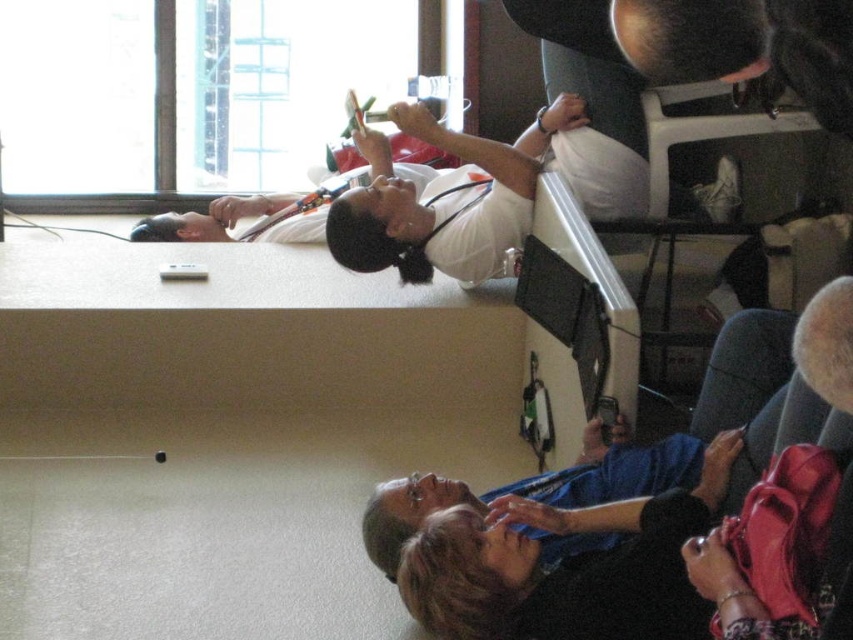
You are a student in a classroom. You see a white matte stethoscope at upper center and a blue fabric shirt at lower right. Which object is closer to you?

The white matte stethoscope at upper center is closer to you because it is further to the viewer than the blue fabric shirt at lower right.